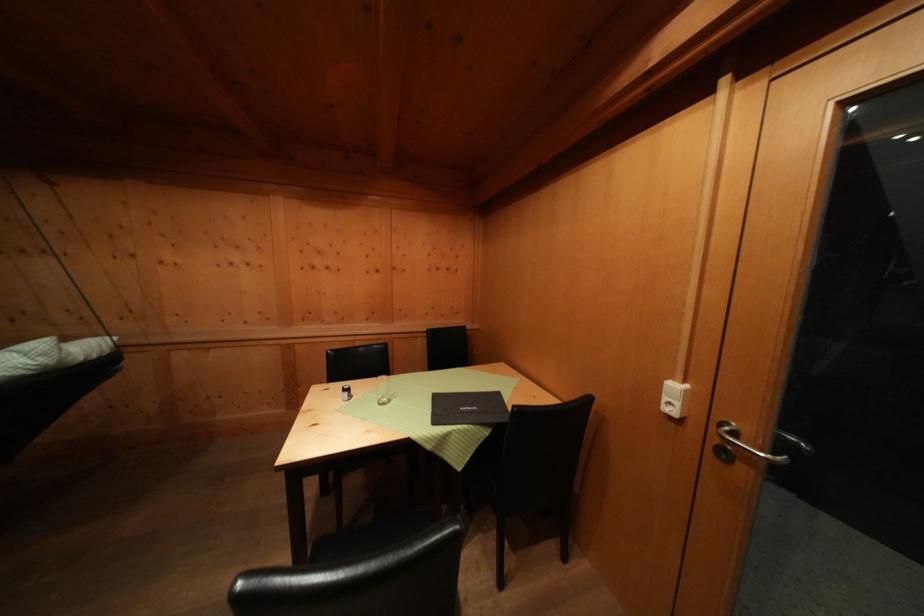
Describe the element at coordinates (346, 392) in the screenshot. I see `a small shaker` at that location.